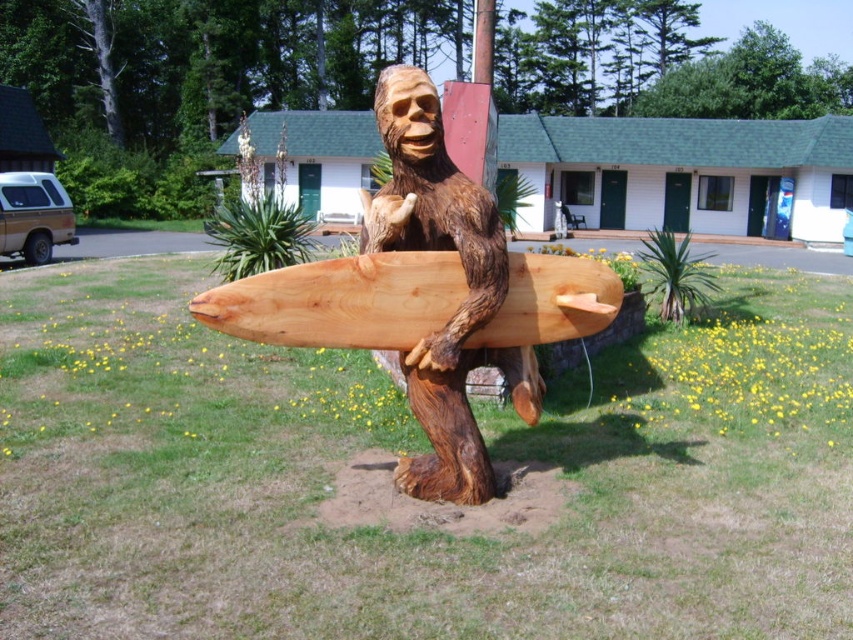
You are standing in front of the Bigfoot sculpture holding a surfboard. You notice two points marked on the sculpture. The first point is at coordinate point (190, 305) and the second is at point (488, 301). Which point is closer to you?

Point (190, 305) is closer to you because it is further to the viewer than point (488, 301).

From the picture: You are a visitor at the motel and see the wooden surfboard at center and the brown wood carving at center. Which object is positioned to the east of the other?

The wooden surfboard at center is to the right of brown wood carving at center, so from an observer facing the sculpture, the wooden surfboard at center would be positioned to the east of the brown wood carving at center.